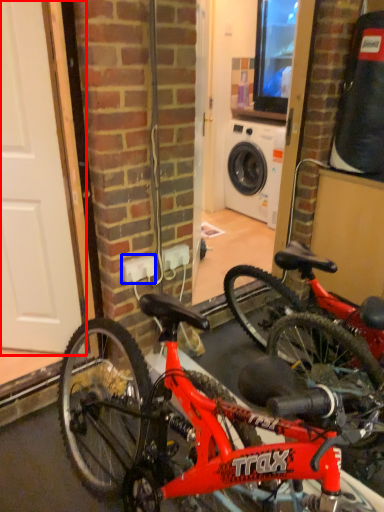
Question: Which object appears farthest to the camera in this image, door (highlighted by a red box) or electric outlet (highlighted by a blue box)?

Choices:
 (A) door
 (B) electric outlet

Answer: (B)